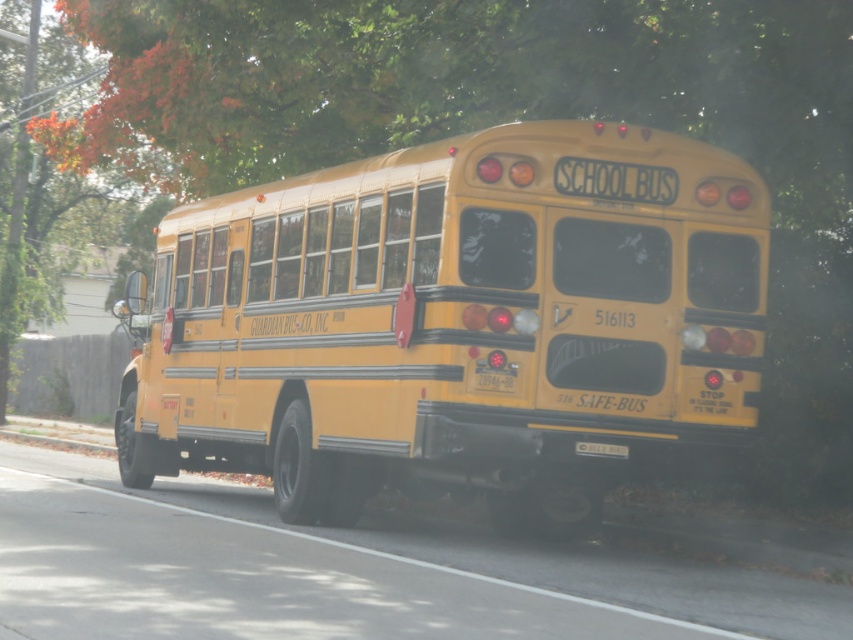
You are standing in front of the yellow school bus and looking at its rear. There are two points marked on the bus, one at point coordinates point (392, 250) and the other at point coordinates point (575, 442). Which point is closer to you?

Point (392, 250) is closer to you because it is further to the viewer than point (575, 442).